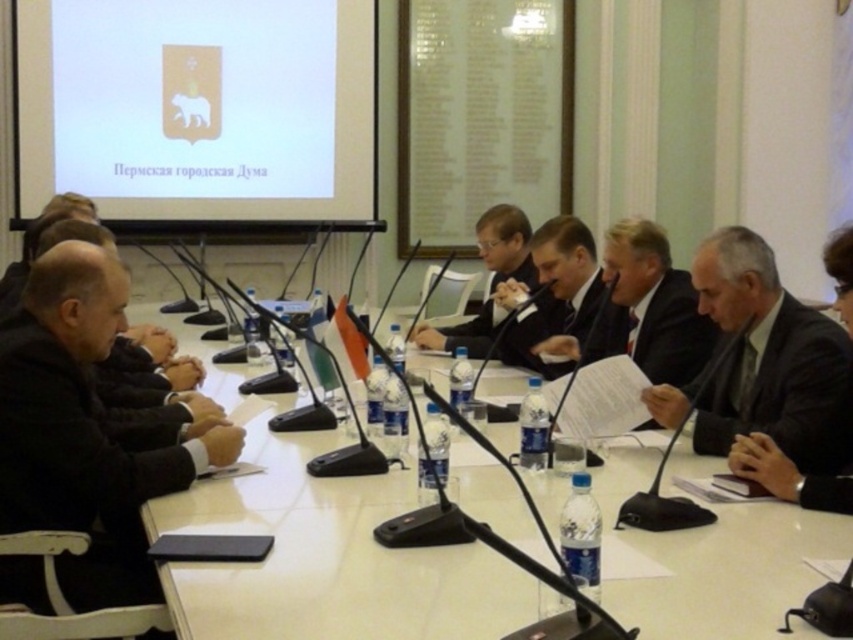
Question: Among these points, which one is farthest from the camera?

Choices:
 (A) (531, 488)
 (B) (119, 280)
 (C) (372, 3)
 (D) (778, 401)

Answer: (C)

Question: Is white glossy coat of arms at upper center behind black suit at left?

Choices:
 (A) no
 (B) yes

Answer: (B)

Question: Among these objects, which one is nearest to the camera?

Choices:
 (A) dark gray suit at right
 (B) matte black suit at center

Answer: (A)

Question: Can you confirm if black suit at left is thinner than matte black suit at center?

Choices:
 (A) no
 (B) yes

Answer: (A)

Question: Considering the real-world distances, which object is farthest from the dark gray suit at right?

Choices:
 (A) black suit at left
 (B) matte black suit at center
 (C) white glossy table at center
 (D) white glossy coat of arms at upper center

Answer: (D)

Question: Considering the relative positions of black suit at left and matte black suit at center in the image provided, where is black suit at left located with respect to matte black suit at center?

Choices:
 (A) right
 (B) left

Answer: (B)